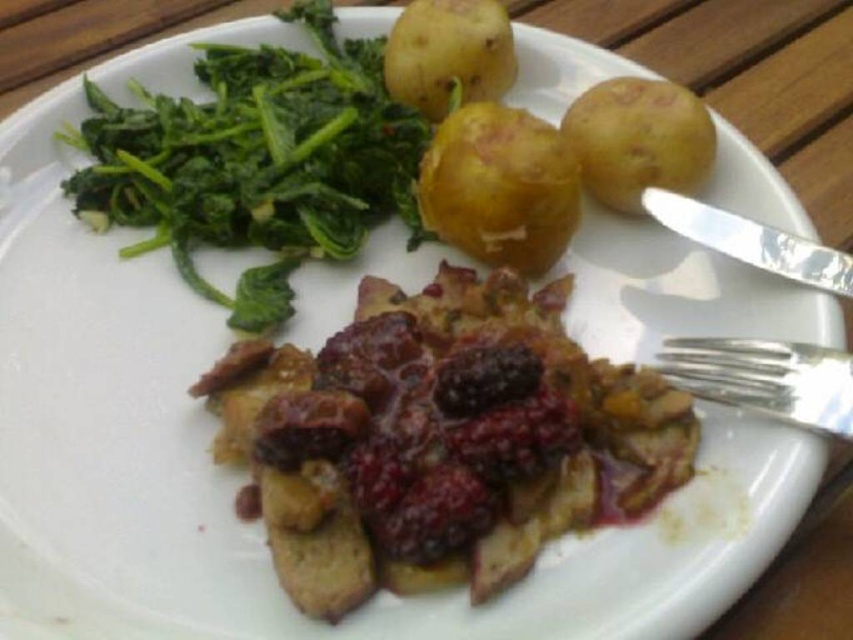
You are a diner trying to reach for the silver metallic fork at right without touching the green leafy vegetable at upper left. Is there enough space between them for your hand to move freely?

The green leafy vegetable at upper left might be wider than the silver metallic fork at right, so there may not be enough space to move your hand freely without touching the vegetable.

You are a food delivery robot that needs to pick up the brown crumbly bread at center and the green leafy vegetable at upper left. The robot has a 10 inch long tool to reach the food items. Can the robot reach both items with the tool?

The brown crumbly bread at center and green leafy vegetable at upper left are 11.29 inches apart from each other. Since the tool is only 10 inches long, the robot cannot reach both items at the same time with the tool.